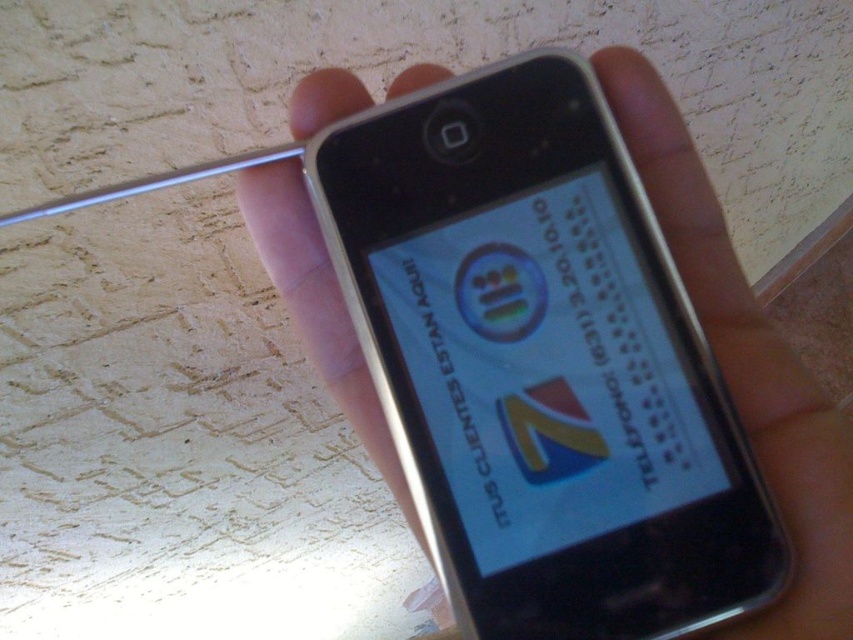
Question: Which point appears closest to the camera in this image?

Choices:
 (A) (753, 454)
 (B) (577, 467)

Answer: (B)

Question: Considering the relative positions of silver metallic phone at center and white glossy logo at center in the image provided, where is silver metallic phone at center located with respect to white glossy logo at center?

Choices:
 (A) right
 (B) left

Answer: (A)

Question: Can you confirm if white glossy text at center is thinner than white glossy logo at center?

Choices:
 (A) yes
 (B) no

Answer: (B)

Question: Does silver metallic phone at center have a larger size compared to white glossy text at center?

Choices:
 (A) no
 (B) yes

Answer: (B)

Question: Which is farther from the silver metallic phone at center?

Choices:
 (A) white glossy logo at center
 (B) white glossy text at center

Answer: (A)

Question: Which point is closer to the camera taking this photo?

Choices:
 (A) (445, 364)
 (B) (637, 429)

Answer: (B)